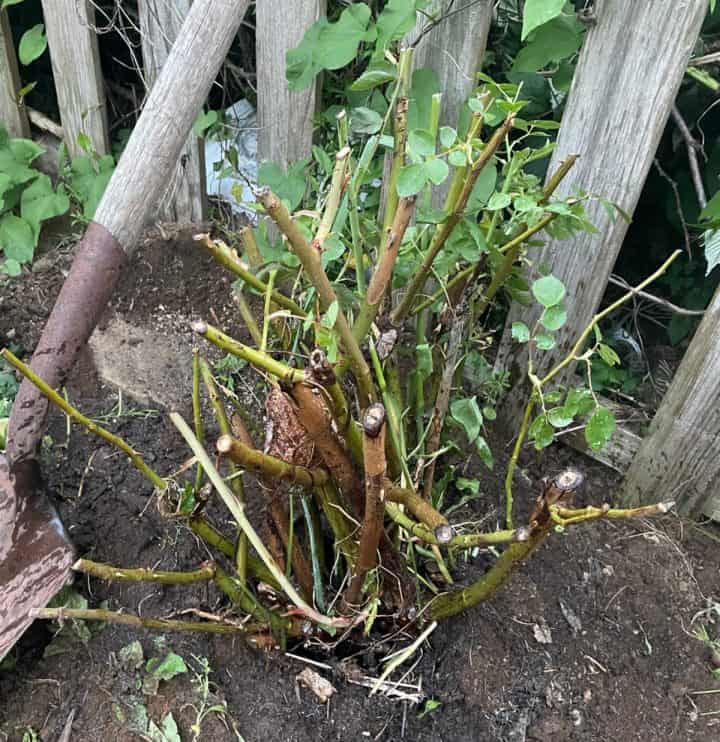
At what (x,y) coordinates should I click in order to perform the action: click on plant. Please return your answer as a coordinate pair (x, y). Looking at the image, I should click on (391, 450).